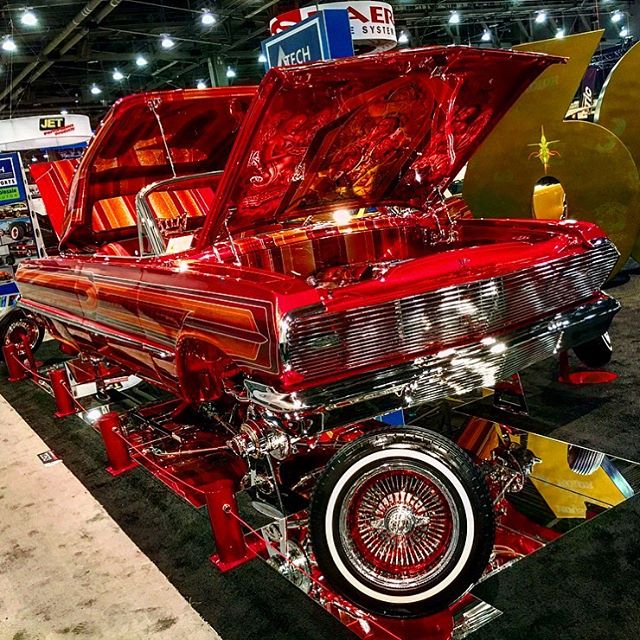
Identify the location of right side door. This screenshot has height=640, width=640. (109, 291).